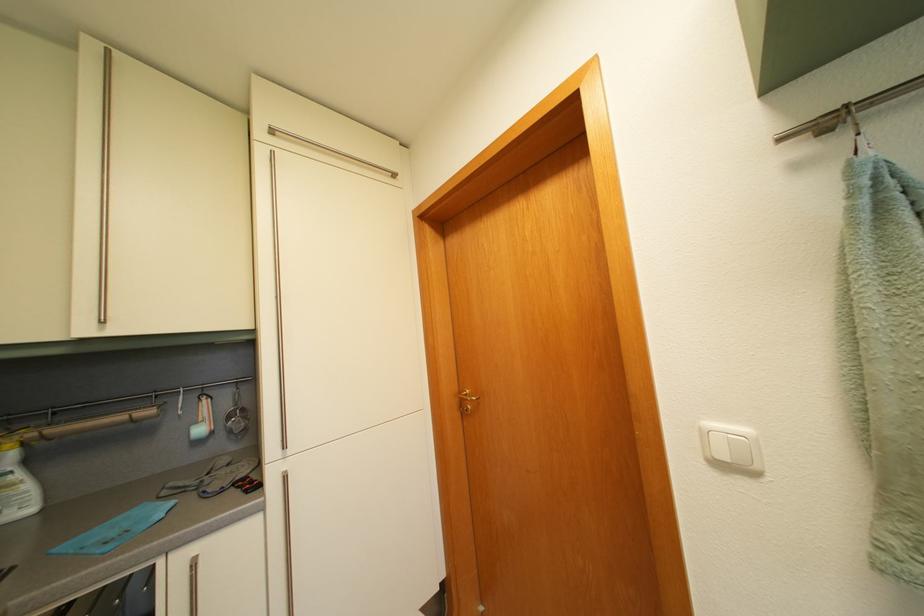
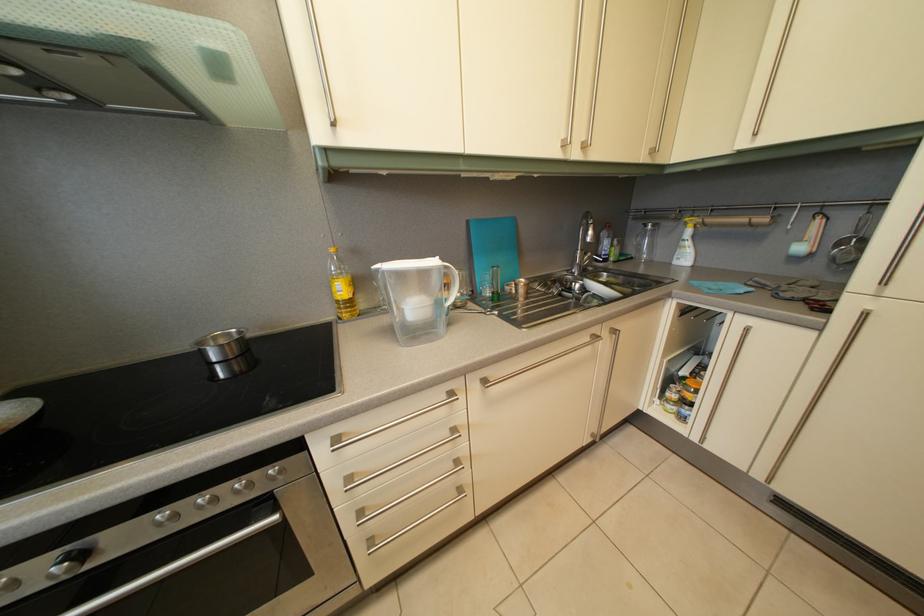
The first image is from the beginning of the video and the second image is from the end. How did the camera likely rotate when shooting the video?

The camera rotated toward left-down.